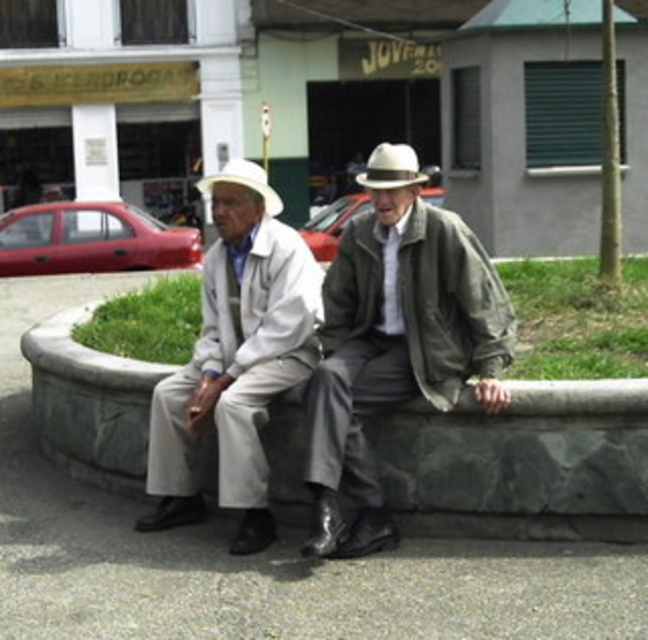
You are a photographer trying to capture a closeup of both the white felt fedora at center and the white matte cowboy hat at center. Since you want to include both in the frame, which hat should you position first in your camera viewfinder to ensure both are visible?

You should position the white matte cowboy hat at center first in your camera viewfinder because the white felt fedora at center is to the right of it, so by starting with the leftmost hat, both will fit in the frame.